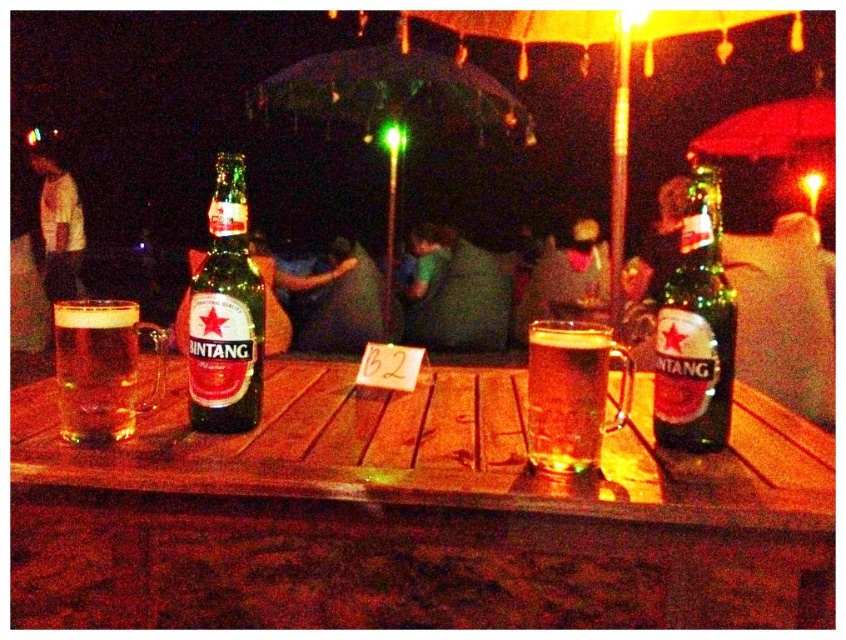
This screenshot has height=640, width=846. What do you see at coordinates (586, 64) in the screenshot?
I see `orange fabric umbrella at upper center` at bounding box center [586, 64].

Can you confirm if orange fabric umbrella at upper center is positioned below translucent glass mug at center?

No, orange fabric umbrella at upper center is not below translucent glass mug at center.

Does point (570, 10) come farther from viewer compared to point (584, 428)?

That is True.

Image resolution: width=846 pixels, height=640 pixels. In order to click on orange fabric umbrella at upper center in this screenshot , I will do `click(586, 64)`.

Which is above, green glass bottle at right or translucent glass mug at center?

Positioned higher is green glass bottle at right.

From the picture: Is green glass bottle at right bigger than translucent glass mug at center?

Incorrect, green glass bottle at right is not larger than translucent glass mug at center.

This screenshot has width=846, height=640. What are the coordinates of `green glass bottle at right` in the screenshot? It's located at (695, 330).

Who is taller, wooden table at center or white cotton shirt at upper left?

A: white cotton shirt at upper left

Is wooden table at center to the left of white cotton shirt at upper left from the viewer's perspective?

No, wooden table at center is not to the left of white cotton shirt at upper left.

This screenshot has width=846, height=640. What do you see at coordinates (409, 516) in the screenshot? I see `wooden table at center` at bounding box center [409, 516].

Find the location of a particular element. wooden table at center is located at coordinates (409, 516).